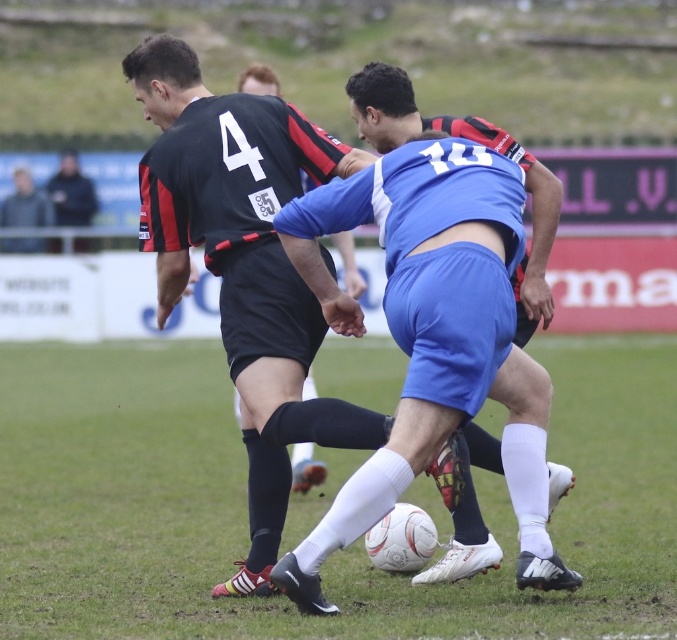
Can you confirm if white textured football at center is thinner than gray fabric jacket at upper left?

In fact, white textured football at center might be wider than gray fabric jacket at upper left.

Does white textured football at center lie behind gray fabric jacket at upper left?

→ No, white textured football at center is closer to the viewer.

Find the location of a particular element. This screenshot has height=640, width=677. white textured football at center is located at coordinates (330, 556).

Find the location of `white textured football at center`. white textured football at center is located at coordinates (330, 556).

Which is below, black matte shorts at center or dark blue jacket at upper left?

black matte shorts at center

At what (x,y) coordinates should I click in order to perform the action: click on black matte shorts at center. Please return your answer as a coordinate pair (x, y). The width and height of the screenshot is (677, 640). Looking at the image, I should click on click(x=305, y=468).

What do you see at coordinates (305, 468) in the screenshot? The height and width of the screenshot is (640, 677). I see `black matte shorts at center` at bounding box center [305, 468].

Where is `black matte shorts at center`? black matte shorts at center is located at coordinates (x=305, y=468).

Can you confirm if white textured football at center is wider than black matte shorts at center?

Yes, white textured football at center is wider than black matte shorts at center.

Which is more to the right, white textured football at center or black matte shorts at center?

From the viewer's perspective, white textured football at center appears more on the right side.

Which is behind, point (589, 464) or point (297, 458)?

The point (589, 464) is more distant.

Locate an element on the screen. This screenshot has height=640, width=677. white textured football at center is located at coordinates (330, 556).